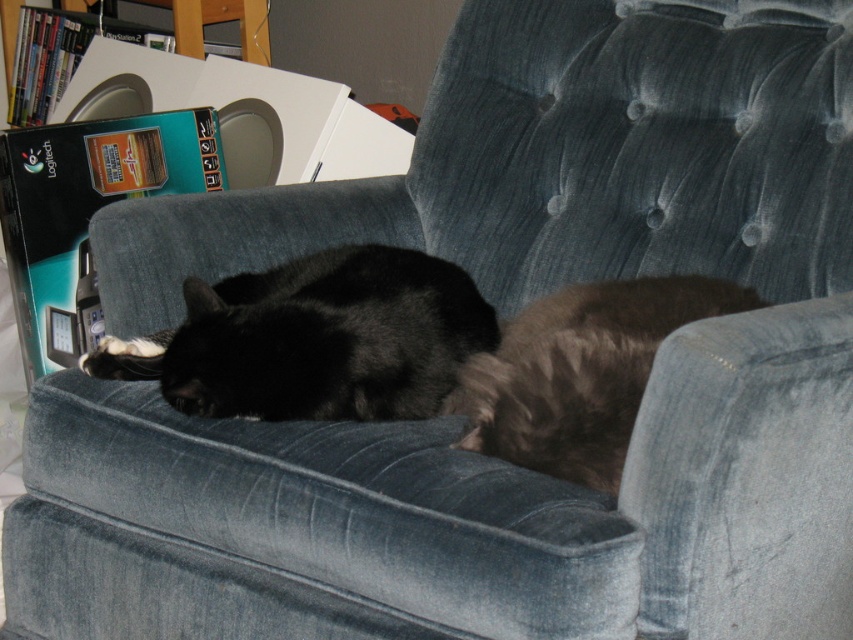
You are a cat owner who wants to place a small toy between the black fur cat at center and the brown fuzzy cat at lower right. Since the cats are different in height, which cat should the toy be placed closer to to ensure it is visible to both?

The toy should be placed closer to the black fur cat at center because it is shorter than the brown fuzzy cat at lower right, so positioning it near the shorter cat would make it visible to both.